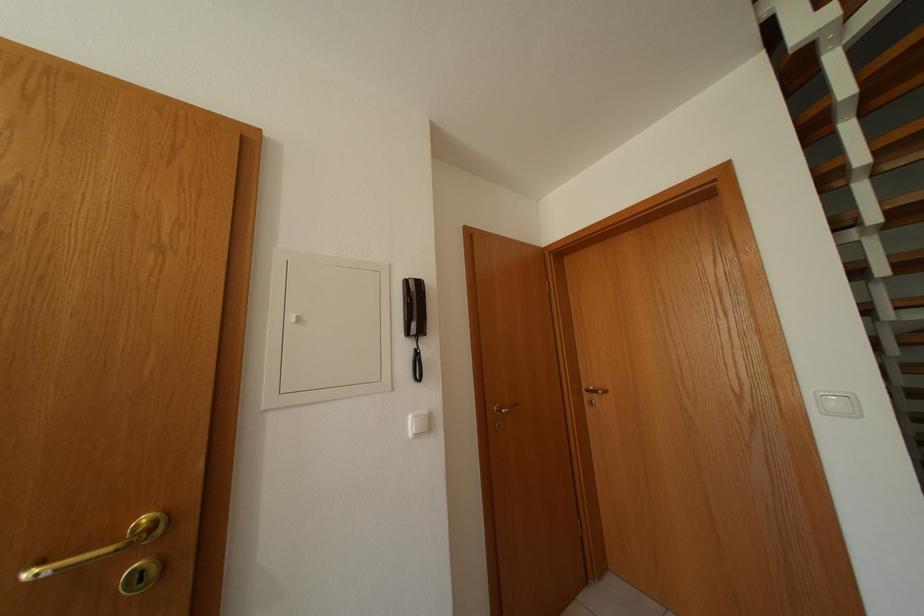
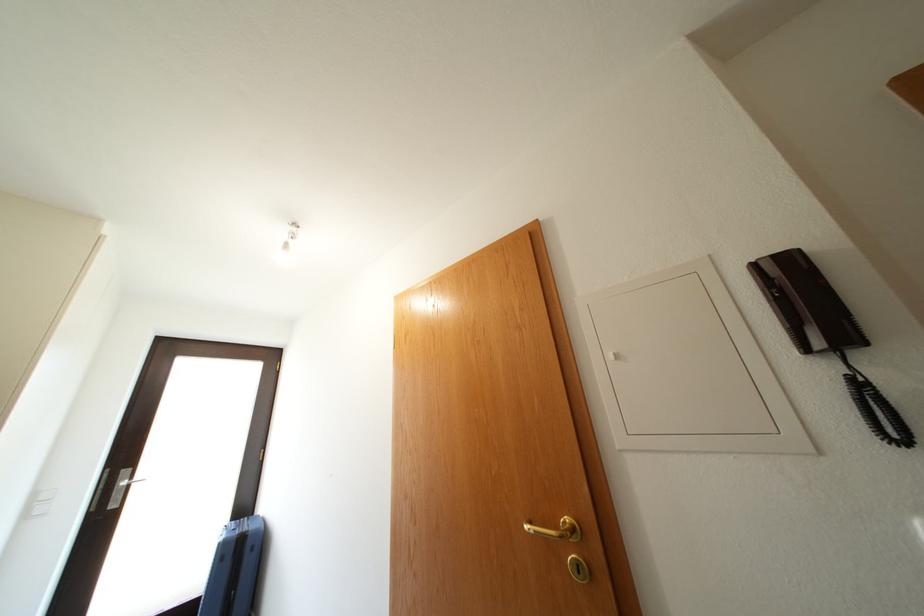
Question: How did the camera likely rotate?

Choices:
 (A) Left
 (B) Right
 (C) Up
 (D) Down

Answer: (A)